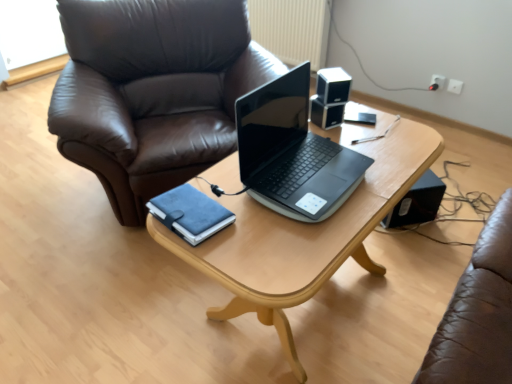
Question: Would you say black glossy speaker at upper right, acting as the 2th speaker starting from the right, is inside or outside suede blue notebook at center?

Choices:
 (A) inside
 (B) outside

Answer: (B)

Question: Considering the positions of black glossy speaker at upper right, positioned as the third speaker in bottom-to-top order, and suede blue notebook at center in the image, is black glossy speaker at upper right, positioned as the third speaker in bottom-to-top order, bigger or smaller than suede blue notebook at center?

Choices:
 (A) small
 (B) big

Answer: (B)

Question: Which object is the closest to the sleek black laptop at center?

Choices:
 (A) suede blue notebook at center
 (B) black plastic speaker at lower right, placed as the third speaker when sorted from left to right
 (C) white plastic electric outlet at upper right
 (D) light wood table at center
 (E) black glossy speaker at upper right, the 1th speaker viewed from the front

Answer: (D)

Question: Estimate the real-world distances between objects in this image. Which object is farther from the black plastic speaker at upper center, which is the 1th speaker in left-to-right order?

Choices:
 (A) suede blue notebook at center
 (B) sleek black laptop at center
 (C) light wood table at center
 (D) black plastic speaker at lower right, acting as the 3th speaker starting from the front
 (E) white plastic electric outlet at upper right

Answer: (E)